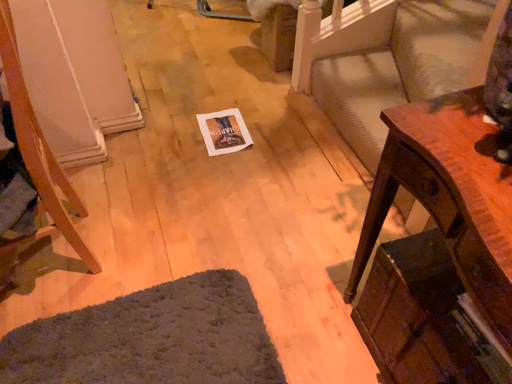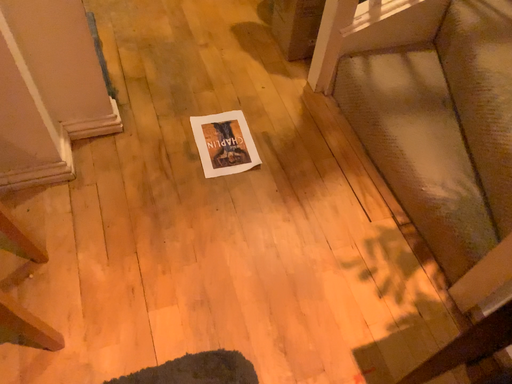
Question: How did the camera likely rotate when shooting the video?

Choices:
 (A) rotated upward
 (B) rotated downward

Answer: (B)